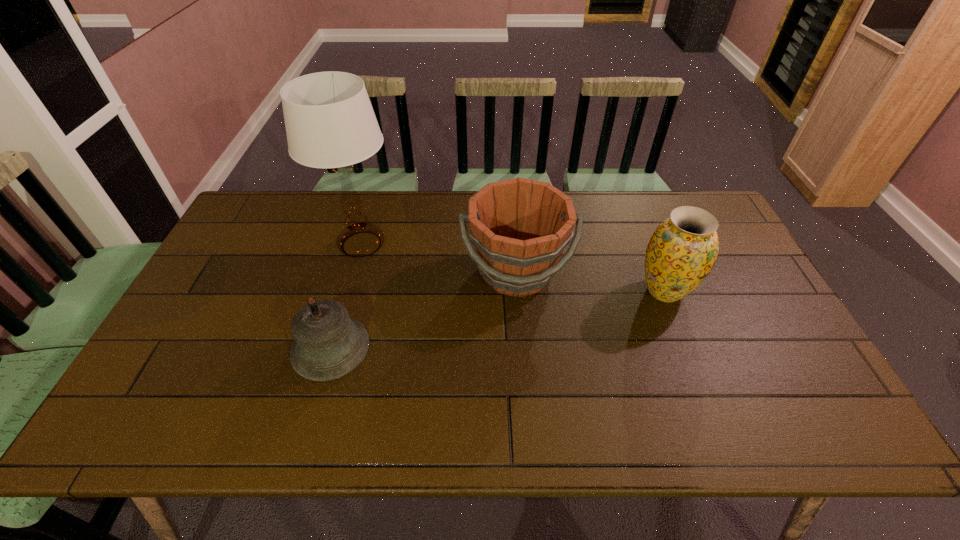
This screenshot has height=540, width=960. What are the coordinates of `vacant space at the far edge of the desktop` in the screenshot? It's located at (443, 214).

Where is `blank space at the left edge`? blank space at the left edge is located at coordinates (253, 242).

Where is `free space at the right edge of the desktop`? Image resolution: width=960 pixels, height=540 pixels. free space at the right edge of the desktop is located at coordinates (720, 278).

At what (x,y) coordinates should I click in order to perform the action: click on vacant area at the far left corner. Please return your answer as a coordinate pair (x, y). The height and width of the screenshot is (540, 960). Looking at the image, I should click on click(x=281, y=201).

Image resolution: width=960 pixels, height=540 pixels. In order to click on vacant space at the far right corner of the desktop in this screenshot , I will do `click(719, 232)`.

Identify the location of vacant space in between the table lamp and the bucket. Image resolution: width=960 pixels, height=540 pixels. (439, 258).

Identify the location of free space between the bell and the rightmost object. (497, 319).

Find the location of a particular element. free spot between the rightmost object and the bell is located at coordinates (497, 319).

You are a GUI agent. You are given a task and a screenshot of the screen. Output one action in this format:
    pyautogui.click(x=<x>, y=<y>)
    Task: Click on the vacant point located between the third object from left to right and the shortest object
    
    Given the screenshot: What is the action you would take?
    pyautogui.click(x=423, y=310)

Where is `free spot between the table lamp and the bucket`? This screenshot has height=540, width=960. free spot between the table lamp and the bucket is located at coordinates (439, 258).